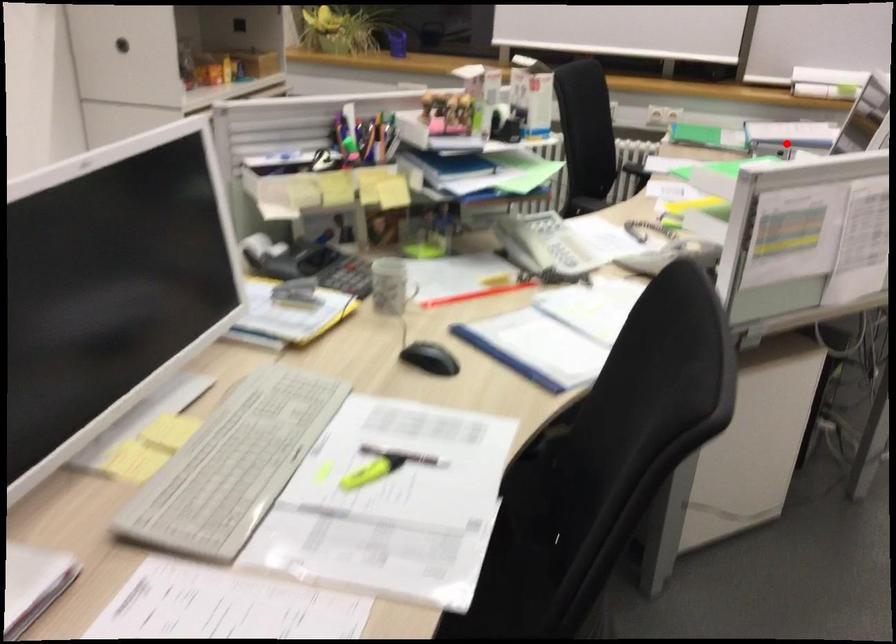
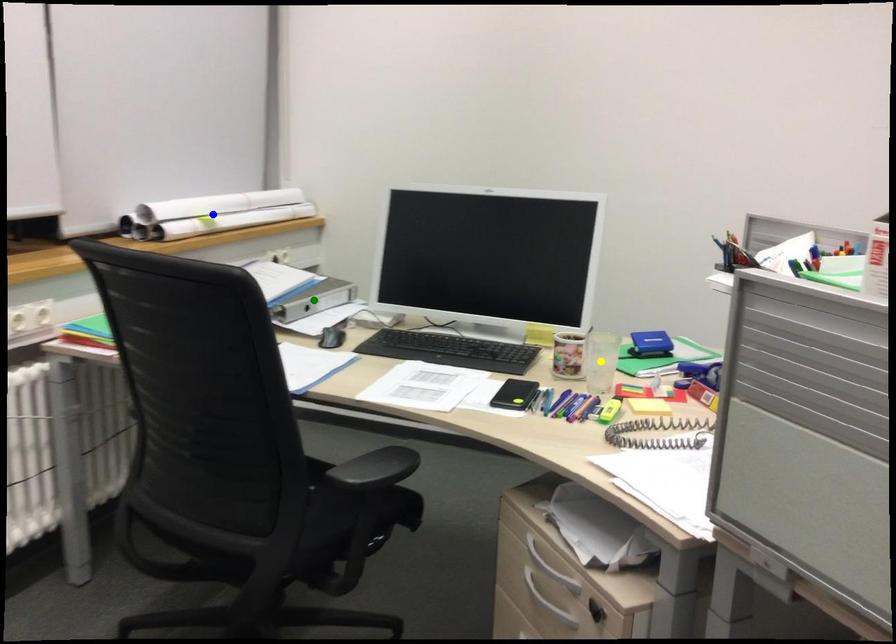
Question: I am providing you with two images of the same scene from different viewpoints. A red point is marked on the first image. You are given multiple points on the second image. In image 2, which mark is for the same physical point as the one in image 1?

Choices:
 (A) yellow point
 (B) green point
 (C) blue point

Answer: (B)